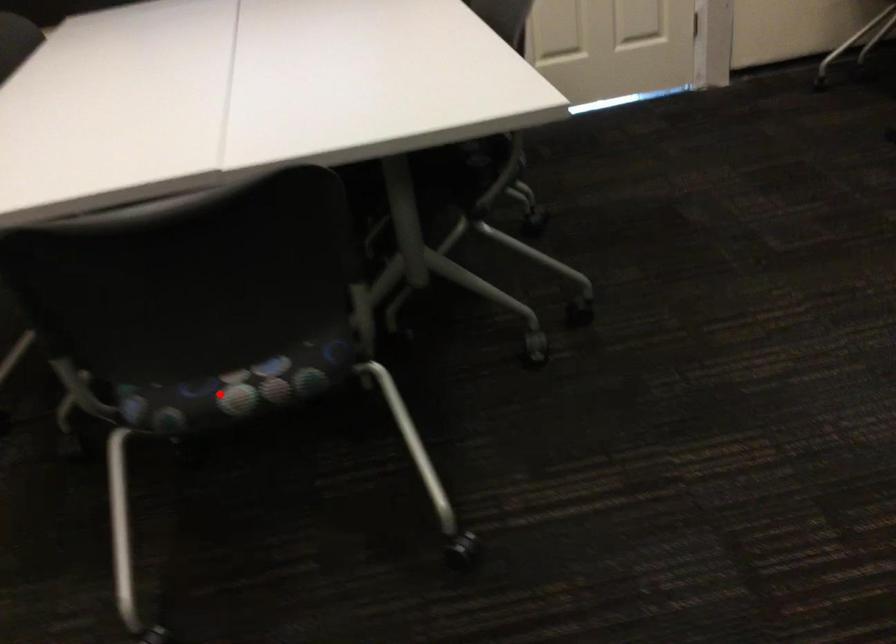
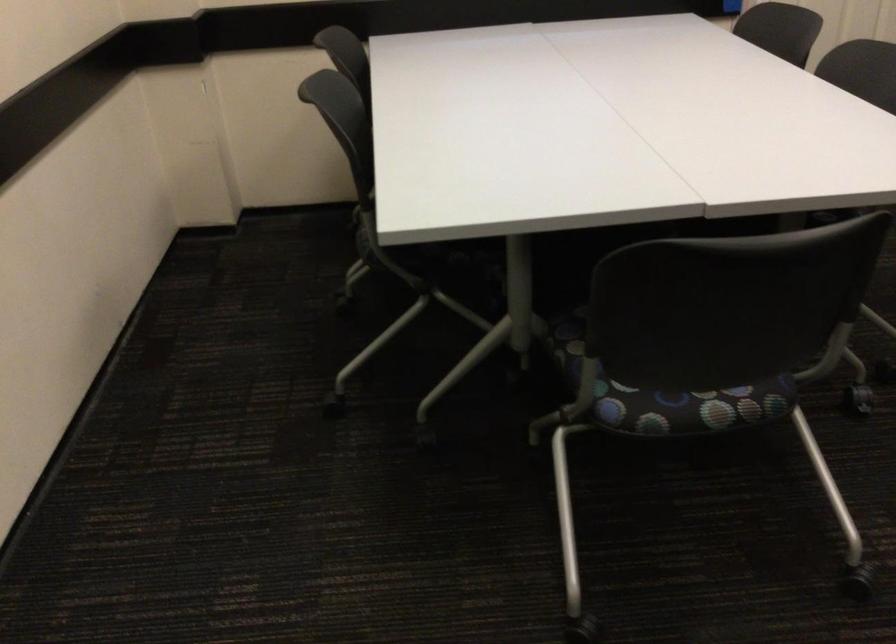
Question: A red point is marked in image1. In image2, is the corresponding 3D point closer to the camera or farther? Reply with the corresponding letter.

Choices:
 (A) The corresponding 3D point is closer.
 (B) The corresponding 3D point is farther.

Answer: (B)